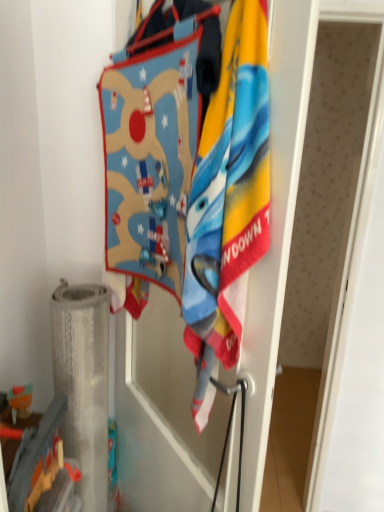
The image size is (384, 512). I want to click on metallic silver toy at lower left, so click(41, 465).

Describe the element at coordinates (41, 465) in the screenshot. This screenshot has width=384, height=512. I see `metallic silver toy at lower left` at that location.

This screenshot has width=384, height=512. Describe the element at coordinates (228, 201) in the screenshot. I see `soft cotton towel at center` at that location.

At what (x,y) coordinates should I click in order to perform the action: click on soft cotton towel at center. Please return your answer as a coordinate pair (x, y). Image resolution: width=384 pixels, height=512 pixels. Looking at the image, I should click on (228, 201).

Identify the location of metallic silver toy at lower left. Image resolution: width=384 pixels, height=512 pixels. 41,465.

Between metallic silver toy at lower left and soft cotton towel at center, which one appears on the left side from the viewer's perspective?

metallic silver toy at lower left.

Considering their positions, is metallic silver toy at lower left located in front of or behind soft cotton towel at center?

metallic silver toy at lower left is behind soft cotton towel at center.

Which is in front, point (45, 433) or point (222, 182)?

Positioned in front is point (222, 182).

From the image's perspective, is metallic silver toy at lower left over soft cotton towel at center?

No, from the image's perspective, metallic silver toy at lower left is not over soft cotton towel at center.

From a real-world perspective, is metallic silver toy at lower left located beneath soft cotton towel at center?

Yes, from a real-world perspective, metallic silver toy at lower left is below soft cotton towel at center.

Considering the sizes of metallic silver toy at lower left and soft cotton towel at center in the image, is metallic silver toy at lower left wider or thinner than soft cotton towel at center?

metallic silver toy at lower left is wider than soft cotton towel at center.

Considering the relative sizes of metallic silver toy at lower left and soft cotton towel at center in the image provided, is metallic silver toy at lower left taller than soft cotton towel at center?

In fact, metallic silver toy at lower left may be shorter than soft cotton towel at center.

Between metallic silver toy at lower left and soft cotton towel at center, which one has larger size?

Bigger between the two is soft cotton towel at center.

Would you say metallic silver toy at lower left contains soft cotton towel at center?

No, soft cotton towel at center is not inside metallic silver toy at lower left.

Is metallic silver toy at lower left with soft cotton towel at center?

No.

Does metallic silver toy at lower left turn towards soft cotton towel at center?

No, metallic silver toy at lower left is not facing towards soft cotton towel at center.

How many degrees apart are the facing directions of metallic silver toy at lower left and soft cotton towel at center?

The angle between the facing direction of metallic silver toy at lower left and the facing direction of soft cotton towel at center is 148 degrees.

How distant is metallic silver toy at lower left from soft cotton towel at center?

metallic silver toy at lower left is 21.78 inches away from soft cotton towel at center.

Locate an element on the screen. towel in front of the metallic silver toy at lower left is located at coordinates (228, 201).

Which is more to the left, soft cotton towel at center or metallic silver toy at lower left?

Positioned to the left is metallic silver toy at lower left.

Which is behind, soft cotton towel at center or metallic silver toy at lower left?

metallic silver toy at lower left is further from the camera.

Which is behind, point (238, 249) or point (17, 467)?

The point (17, 467) is farther from the camera.

From the image's perspective, between soft cotton towel at center and metallic silver toy at lower left, who is located below?

metallic silver toy at lower left is shown below in the image.

From a real-world perspective, between soft cotton towel at center and metallic silver toy at lower left, who is vertically higher?

soft cotton towel at center, from a real-world perspective.

Considering the sizes of objects soft cotton towel at center and metallic silver toy at lower left in the image provided, who is thinner, soft cotton towel at center or metallic silver toy at lower left?

soft cotton towel at center is thinner.

Is soft cotton towel at center taller than metallic silver toy at lower left?

Correct, soft cotton towel at center is much taller as metallic silver toy at lower left.

Considering the relative sizes of soft cotton towel at center and metallic silver toy at lower left in the image provided, is soft cotton towel at center bigger than metallic silver toy at lower left?

Yes, soft cotton towel at center is bigger than metallic silver toy at lower left.

Choose the correct answer: Is soft cotton towel at center inside metallic silver toy at lower left or outside it?

soft cotton towel at center is located beyond the bounds of metallic silver toy at lower left.

Consider the image. Would you say soft cotton towel at center is a long distance from metallic silver toy at lower left?

They are positioned close to each other.

Is soft cotton towel at center facing away from metallic silver toy at lower left?

No, soft cotton towel at center is not facing away from metallic silver toy at lower left.

The width and height of the screenshot is (384, 512). Identify the location of towel above the metallic silver toy at lower left (from the image's perspective). (228, 201).

Find the location of a particular element. This screenshot has height=512, width=384. toy below the soft cotton towel at center (from the image's perspective) is located at coordinates (41, 465).

Find the location of a particular element. The width and height of the screenshot is (384, 512). toy beneath the soft cotton towel at center (from a real-world perspective) is located at coordinates (41, 465).